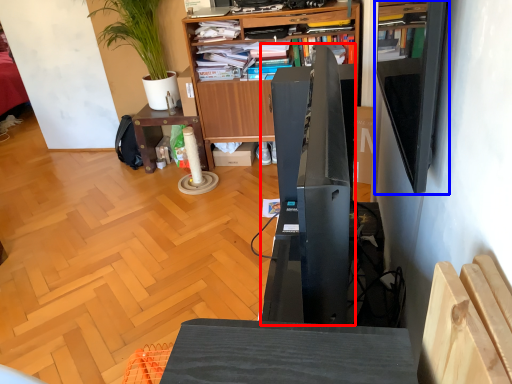
Question: Which of the following is the closest to the observer, appliance (highlighted by a red box) or shelf (highlighted by a blue box)?

Choices:
 (A) appliance
 (B) shelf

Answer: (A)